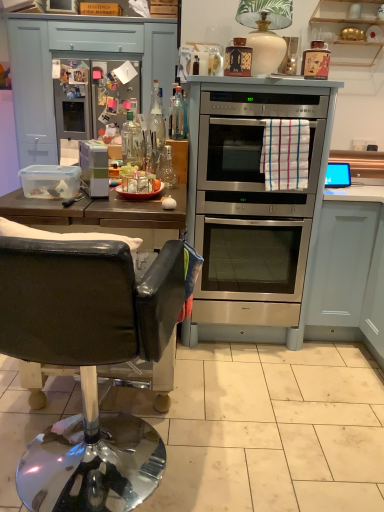
Question: Visually, is silver metallic oven at center, which appears as the 2th appliance when viewed from the top, positioned to the left or to the right of stainless steel oven at center?

Choices:
 (A) right
 (B) left

Answer: (A)

Question: Is silver metallic oven at center, which appears as the 2th appliance when viewed from the top, bigger or smaller than stainless steel oven at center?

Choices:
 (A) big
 (B) small

Answer: (B)

Question: Based on their relative distances, which object is nearer to the clear glass bottle at center?

Choices:
 (A) matte black bottle at upper right, marked as the second appliance in a left-to-right arrangement
 (B) black leather chair at left
 (C) stainless steel oven at center
 (D) wooden shelves at upper right, which is counted as the 2th cabinetry, starting from the bottom
 (E) silver metallic oven at center, which is counted as the 1th appliance, starting from the right

Answer: (C)

Question: Which object is positioned farthest from the silver metallic oven at center, positioned as the 1th appliance in back-to-front order?

Choices:
 (A) satin silver fridge at upper left
 (B) matte black bottle at upper right, marked as the second appliance in a left-to-right arrangement
 (C) clear glass bottle at center
 (D) white plastic container at left, which is the 1th appliance in bottom-to-top order
 (E) white matte cabinet at lower right, marked as the 2th cabinetry in a top-to-bottom arrangement

Answer: (A)